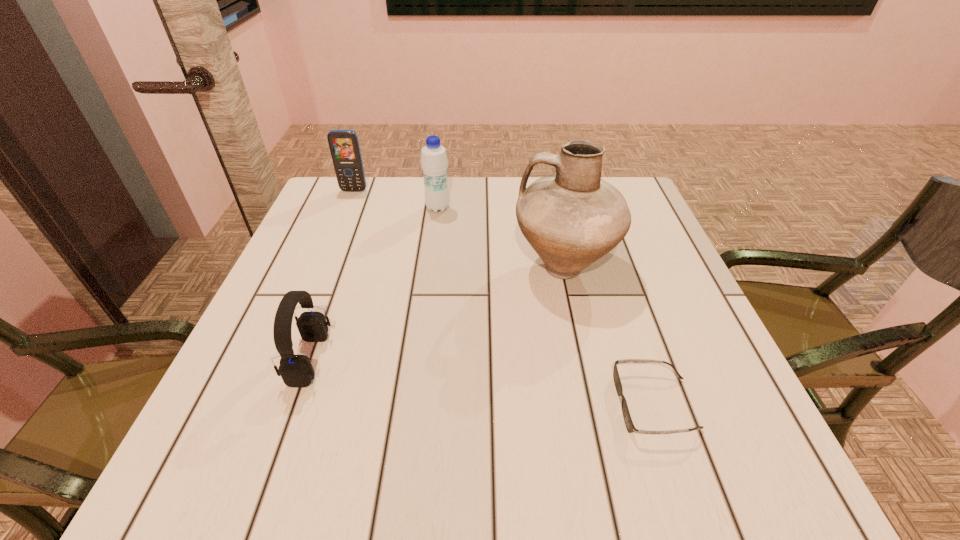
The height and width of the screenshot is (540, 960). I want to click on vacant area situated on the front of the water bottle, so click(x=432, y=251).

Image resolution: width=960 pixels, height=540 pixels. I want to click on vacant space situated on the screen of the cellular telephone, so click(321, 273).

You are a GUI agent. You are given a task and a screenshot of the screen. Output one action in this format:
    pyautogui.click(x=<x>, y=<y>)
    Task: Click on the vacant point located on the headband of the headset
    
    Given the screenshot: What is the action you would take?
    click(x=392, y=359)

The width and height of the screenshot is (960, 540). What are the coordinates of `vacant space situated on the front-facing side of the shortest object` in the screenshot? It's located at (379, 404).

This screenshot has height=540, width=960. What are the coordinates of `vacant area located on the front-facing side of the shortest object` in the screenshot? It's located at (582, 404).

The image size is (960, 540). I want to click on blank area located 0.060m on the front-facing side of the shortest object, so click(582, 404).

Where is `water bottle that is at the far edge`? The height and width of the screenshot is (540, 960). water bottle that is at the far edge is located at coordinates (434, 160).

Where is `cellular telephone that is at the far edge`? The image size is (960, 540). cellular telephone that is at the far edge is located at coordinates (344, 146).

This screenshot has width=960, height=540. What are the coordinates of `object at the near edge` in the screenshot? It's located at (629, 424).

This screenshot has height=540, width=960. I want to click on cellular telephone present at the left edge, so click(344, 146).